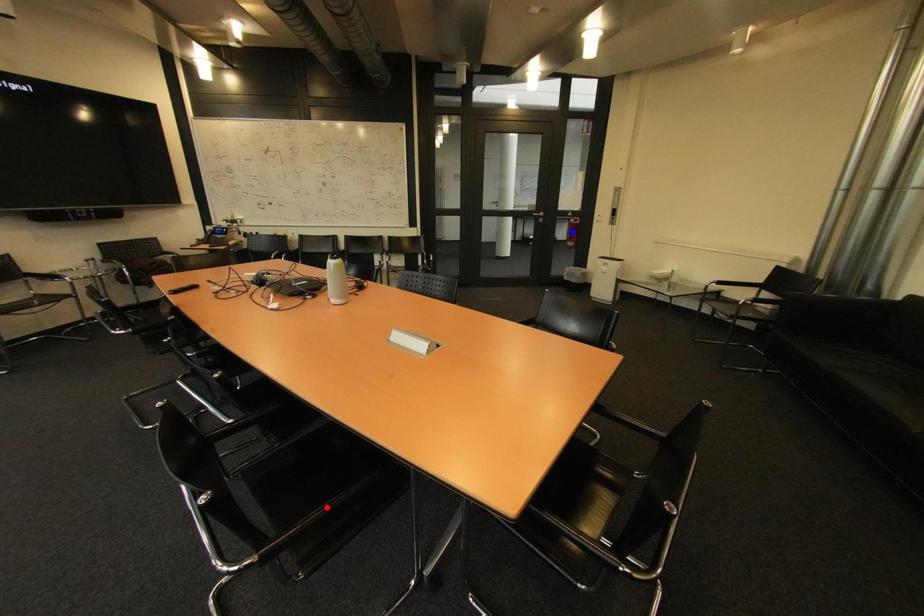
Question: Two points are marked on the image. Which point is closer to the camera?

Choices:
 (A) Blue point is closer.
 (B) Red point is closer.

Answer: (B)